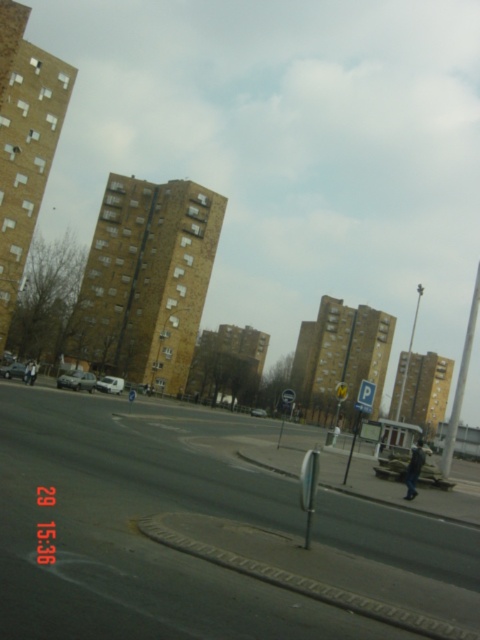
Question: Is smooth asphalt road at center in front of white matte van at center?

Choices:
 (A) yes
 (B) no

Answer: (A)

Question: Which object is farther from the camera taking this photo?

Choices:
 (A) smooth asphalt road at center
 (B) matte silver van at lower left

Answer: (B)

Question: Among these points, which one is nearest to the camera?

Choices:
 (A) (106, 381)
 (B) (180, 413)

Answer: (B)

Question: Considering the real-world distances, which object is closest to the metallic silver car at center?

Choices:
 (A) smooth asphalt road at center
 (B) white matte van at center
 (C) silver metallic car at center

Answer: (B)

Question: Does silver metallic car at center have a greater width compared to matte silver van at lower left?

Choices:
 (A) yes
 (B) no

Answer: (A)

Question: Is smooth asphalt road at center bigger than matte silver van at lower left?

Choices:
 (A) no
 (B) yes

Answer: (B)